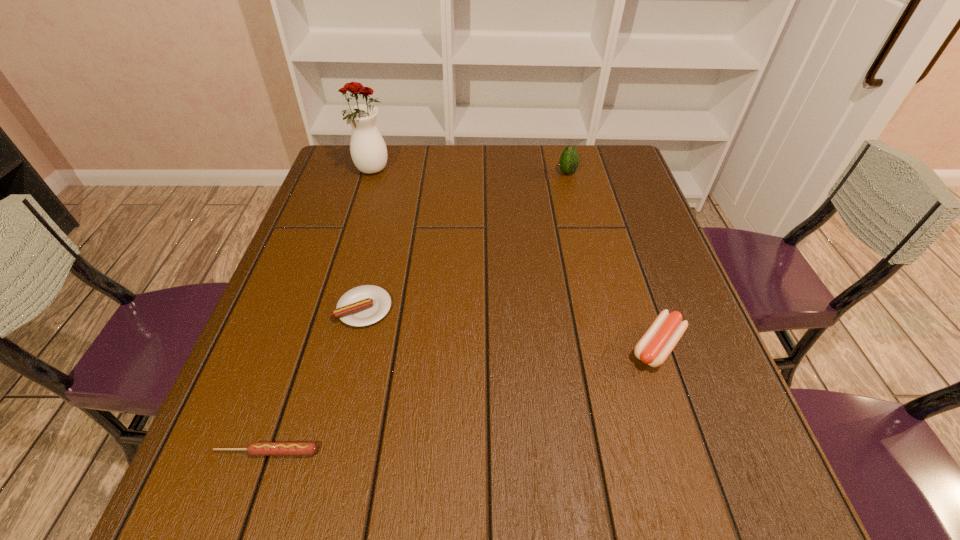
The width and height of the screenshot is (960, 540). I want to click on vacant area at the right edge, so click(x=636, y=305).

The width and height of the screenshot is (960, 540). Identify the location of free space at the far left corner of the desktop. (349, 173).

The height and width of the screenshot is (540, 960). I want to click on vacant region between the tallest object and the nearest sausage, so click(x=320, y=312).

The image size is (960, 540). Identify the location of empty location between the fourth object from left to right and the tallest object. (470, 172).

Identify the location of vacant space in between the nearest object and the rightmost sausage. (463, 399).

Identify the location of vacant area that lies between the third shortest object and the nearest object. This screenshot has width=960, height=540. (463, 399).

The width and height of the screenshot is (960, 540). In order to click on empty location between the vase and the second shortest object in this screenshot , I will do `click(369, 240)`.

This screenshot has width=960, height=540. In order to click on free area in between the second shortest sausage and the fourth shortest object in this screenshot , I will do `click(466, 241)`.

This screenshot has width=960, height=540. What are the coordinates of `free point between the vase and the nearest object` in the screenshot? It's located at (320, 312).

This screenshot has height=540, width=960. What are the coordinates of `unoccupied area between the nearest sausage and the second tallest object` in the screenshot? It's located at (418, 313).